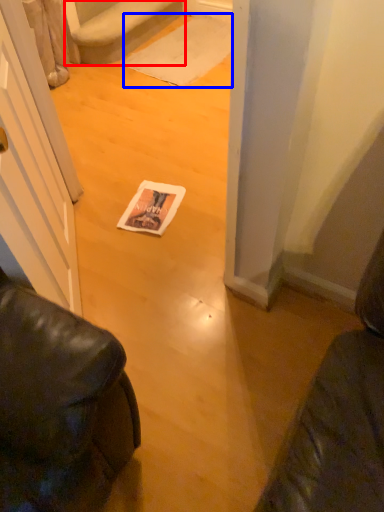
Question: Which point is closer to the camera, stairwell (highlighted by a red box) or doormat (highlighted by a blue box)?

Choices:
 (A) stairwell
 (B) doormat

Answer: (A)